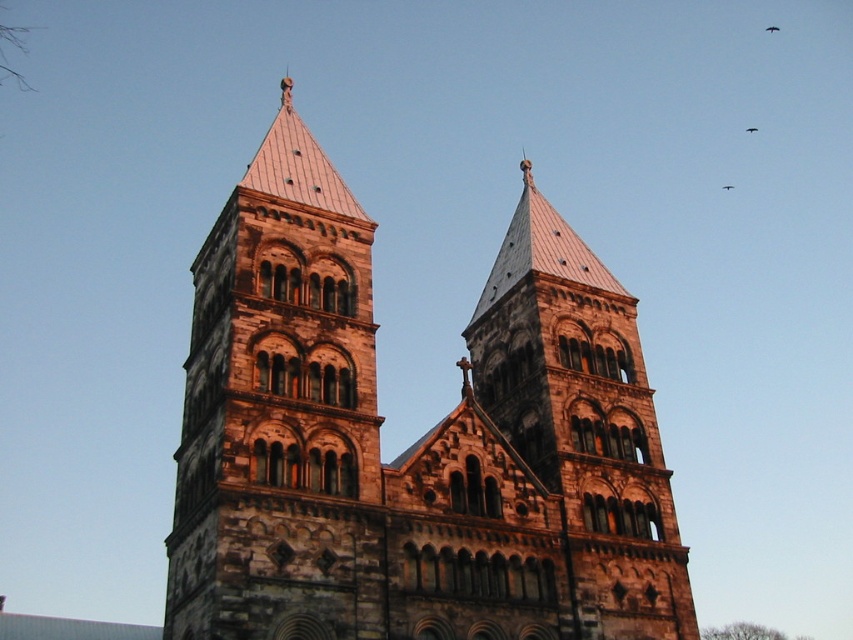
You are standing in front of the historic stone church and want to take a photo that includes both the brown stone church at center and the brown stone tower at left. Based on their positions, which one should you focus on first to ensure both are in the frame?

The brown stone church at center is located below the brown stone tower at left, so you should focus on the brown stone tower at left first to ensure both are in the frame.